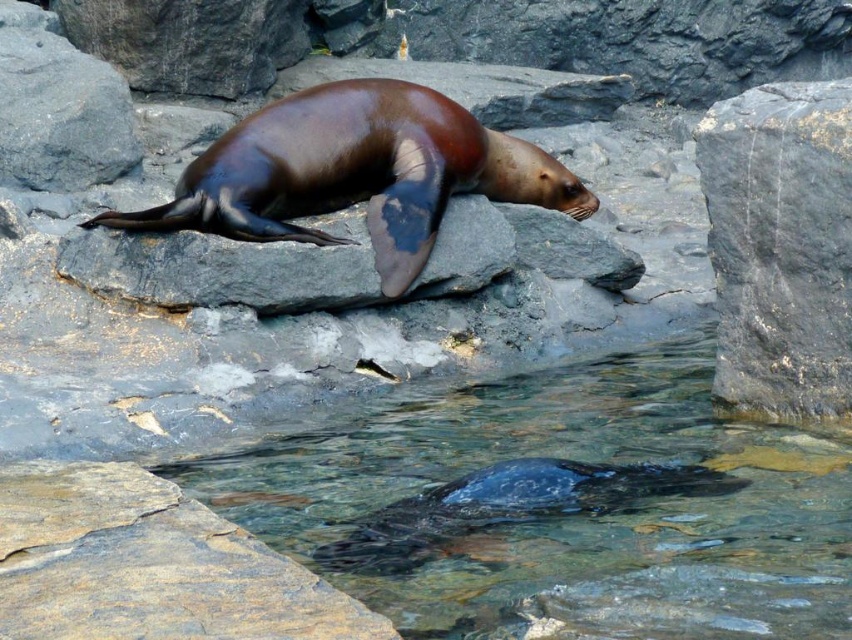
Question: Among these objects, which one is farthest from the camera?

Choices:
 (A) clear water at lower center
 (B) gray rough rock at center right

Answer: (B)

Question: Can you confirm if clear water at lower center is positioned to the left of gray rough rock at center right?

Choices:
 (A) yes
 (B) no

Answer: (A)

Question: Considering the real-world distances, which object is farthest from the gray rough rock at center right?

Choices:
 (A) clear water at lower center
 (B) brown smooth rock at lower center
 (C) shiny brown seal at center

Answer: (B)

Question: Does brown smooth rock at lower center appear under shiny brown seal at center?

Choices:
 (A) no
 (B) yes

Answer: (B)

Question: Is shiny brown seal at center positioned in front of gray rough rock at center right?

Choices:
 (A) no
 (B) yes

Answer: (A)

Question: Which of these objects is positioned farthest from the clear water at lower center?

Choices:
 (A) brown smooth rock at lower center
 (B) shiny brown seal at center
 (C) brown matte rock at center

Answer: (B)